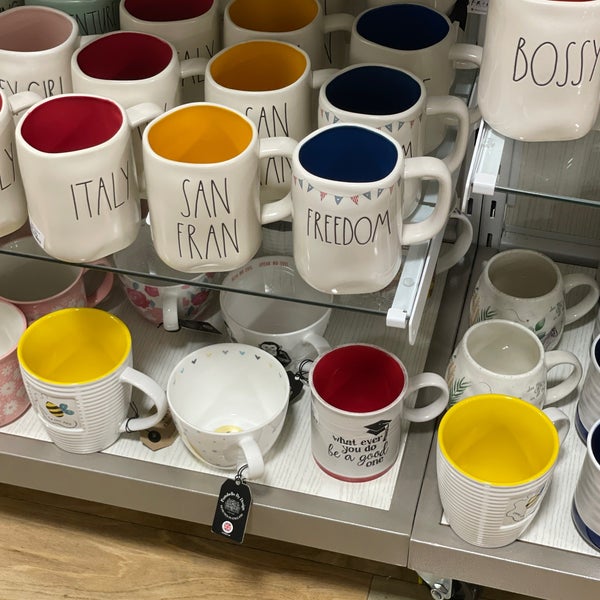
Identify the location of tags on cups. (228, 508), (164, 437), (296, 390), (195, 322).